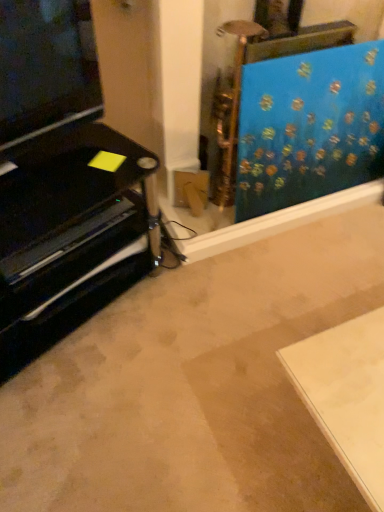
Question: Should I look upward or downward to see blue fabric at upper right?

Choices:
 (A) down
 (B) up

Answer: (B)

Question: Is blue fabric at upper right surrounded by black glossy entertainment unit at left?

Choices:
 (A) no
 (B) yes

Answer: (A)

Question: Can you confirm if black glossy entertainment unit at left is wider than blue fabric at upper right?

Choices:
 (A) yes
 (B) no

Answer: (A)

Question: Is black glossy entertainment unit at left at the right side of blue fabric at upper right?

Choices:
 (A) no
 (B) yes

Answer: (A)

Question: From the image's perspective, is black glossy entertainment unit at left located beneath blue fabric at upper right?

Choices:
 (A) yes
 (B) no

Answer: (A)

Question: Is black glossy entertainment unit at left outside of blue fabric at upper right?

Choices:
 (A) yes
 (B) no

Answer: (A)

Question: Considering the relative sizes of black glossy entertainment unit at left and blue fabric at upper right in the image provided, is black glossy entertainment unit at left shorter than blue fabric at upper right?

Choices:
 (A) yes
 (B) no

Answer: (A)

Question: Can you confirm if blue fabric at upper right is smaller than black glossy entertainment unit at left?

Choices:
 (A) yes
 (B) no

Answer: (A)

Question: Does blue fabric at upper right appear on the right side of black glossy entertainment unit at left?

Choices:
 (A) no
 (B) yes

Answer: (B)

Question: From the image's perspective, is blue fabric at upper right above black glossy entertainment unit at left?

Choices:
 (A) yes
 (B) no

Answer: (A)

Question: Is blue fabric at upper right oriented away from black glossy entertainment unit at left?

Choices:
 (A) no
 (B) yes

Answer: (A)

Question: Is blue fabric at upper right positioned in front of black glossy entertainment unit at left?

Choices:
 (A) no
 (B) yes

Answer: (A)

Question: Considering the relative positions of blue fabric at upper right and black glossy entertainment unit at left in the image provided, is blue fabric at upper right behind black glossy entertainment unit at left?

Choices:
 (A) no
 (B) yes

Answer: (B)

Question: Would you say black glossy entertainment unit at left is inside or outside blue fabric at upper right?

Choices:
 (A) outside
 (B) inside

Answer: (A)